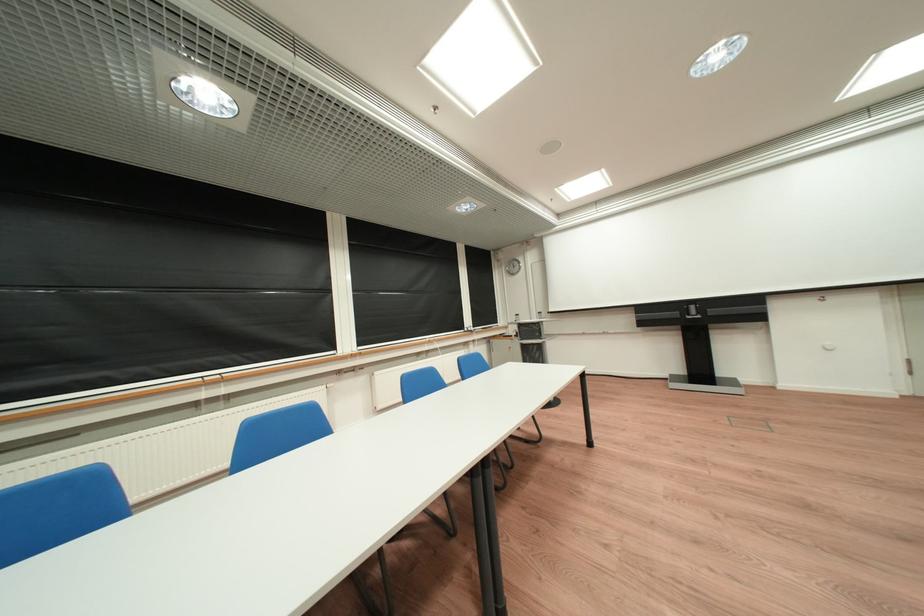
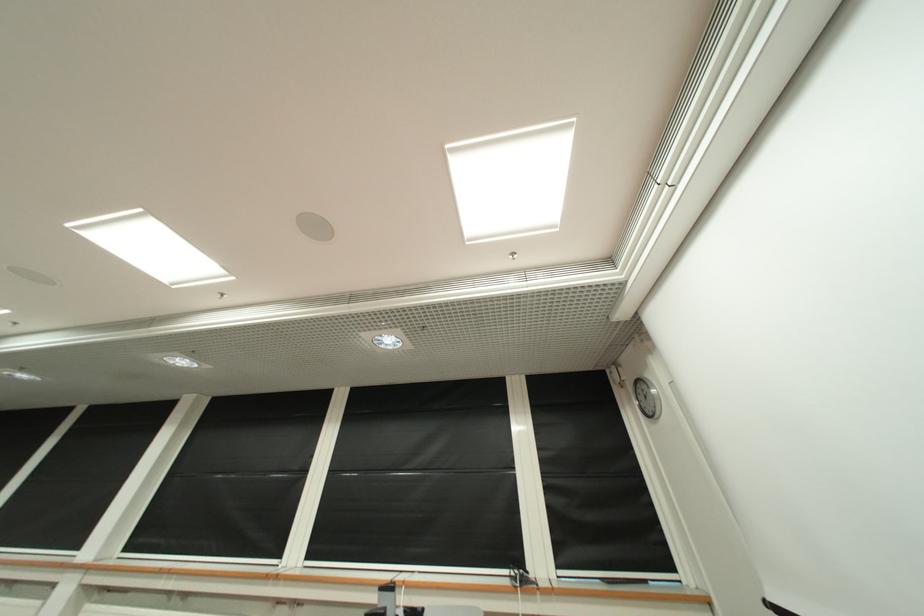
Find the pixel in the second image that matches the point at 513,269 in the first image.

(642, 402)